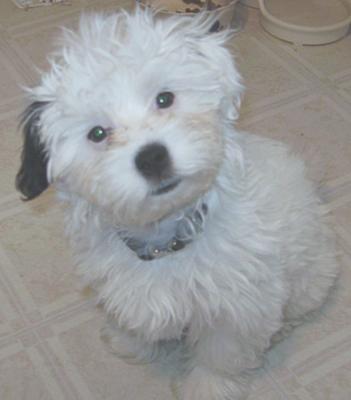
Identify the location of beige tile floor. The width and height of the screenshot is (351, 400). (110, 378).